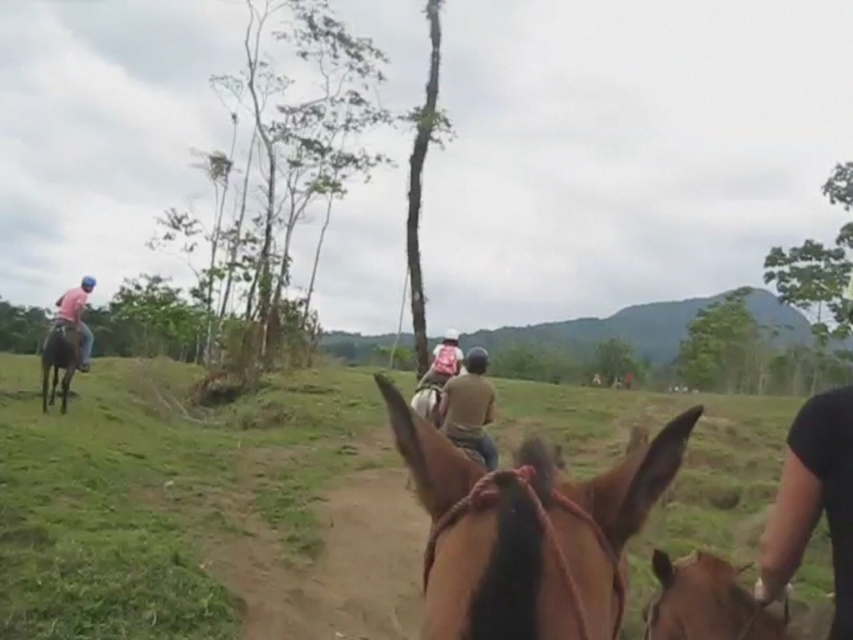
Identify the location of brown glossy horse at center. (527, 531).

Does brown glossy horse at center have a lesser width compared to matte pink shirt at left?

Incorrect, brown glossy horse at center's width is not less than matte pink shirt at left's.

Who is more distant from viewer, (581, 593) or (86, 342)?

The point (86, 342) is more distant.

The width and height of the screenshot is (853, 640). What are the coordinates of `brown glossy horse at center` in the screenshot? It's located at (527, 531).

From the picture: Does brown leather horse at lower right have a greater width compared to brown leather horse at left?

Incorrect, brown leather horse at lower right's width does not surpass brown leather horse at left's.

Between brown leather horse at lower right and brown leather horse at left, which one is positioned lower?

brown leather horse at lower right

Find the location of a particular element. The width and height of the screenshot is (853, 640). brown leather horse at lower right is located at coordinates (706, 602).

Who is shorter, brown glossy horse at center or brown leather horse at lower right?

Standing shorter between the two is brown leather horse at lower right.

Who is lower down, brown glossy horse at center or brown leather horse at lower right?

brown leather horse at lower right is lower down.

Find the location of a particular element. The image size is (853, 640). brown glossy horse at center is located at coordinates (527, 531).

Identify the location of brown glossy horse at center. tap(527, 531).